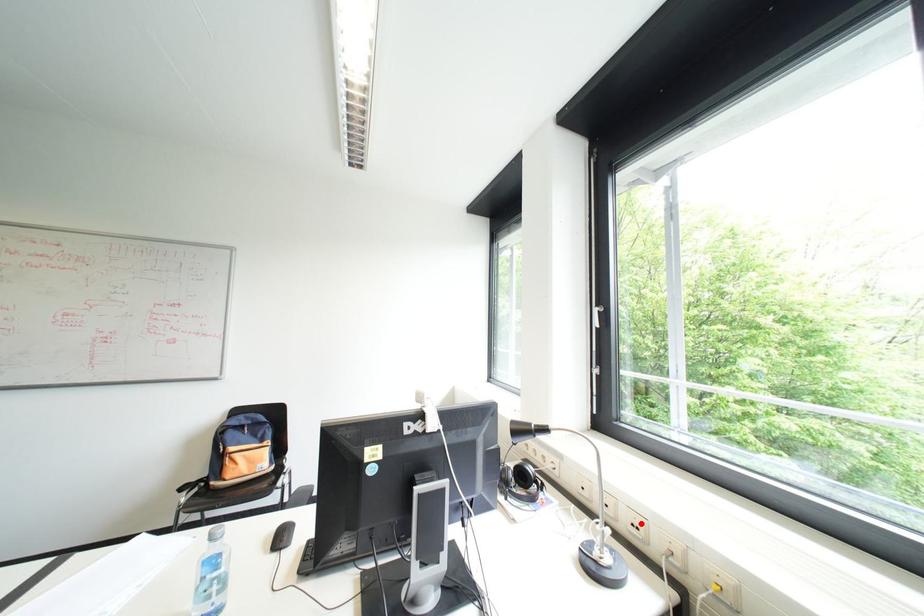
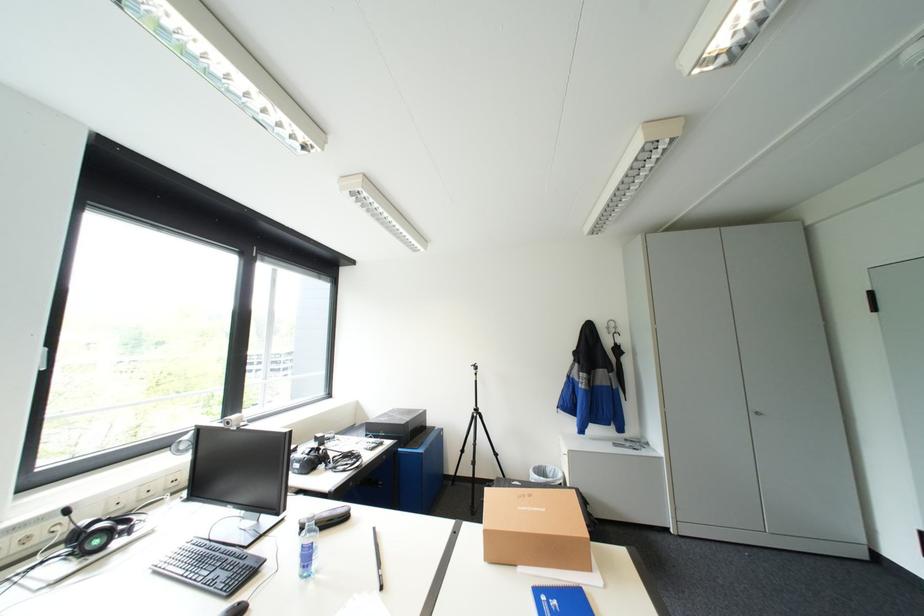
Question: I am providing you with two images of the same scene from different viewpoints. A red point is marked on the first image. At the location where the point appears in image 1, is it still visible in image 2?

Choices:
 (A) Yes
 (B) No

Answer: (B)